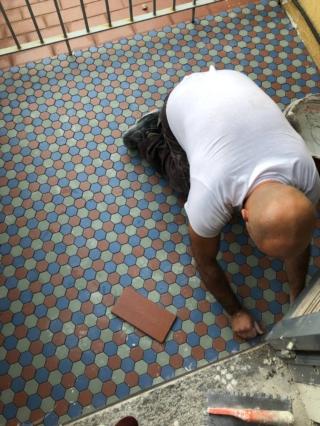
This screenshot has width=320, height=426. Find the location of `red brick floor`. red brick floor is located at coordinates 94,41.